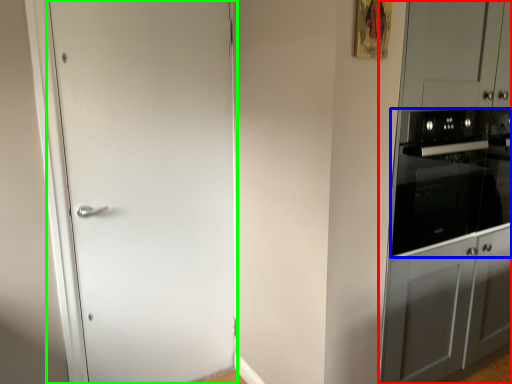
Question: Which object is the farthest from dresser (highlighted by a red box)? Choose among these: home appliance (highlighted by a blue box) or door (highlighted by a green box).

Choices:
 (A) home appliance
 (B) door

Answer: (B)